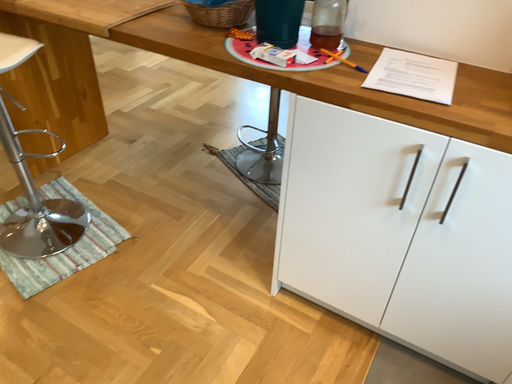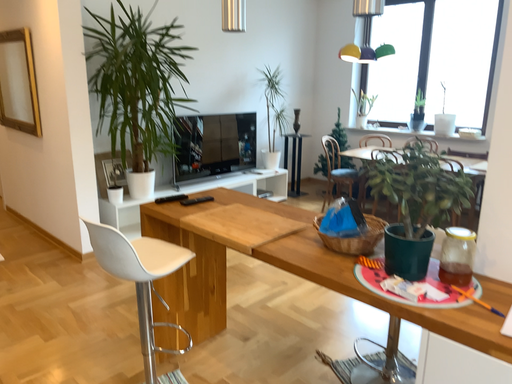
Question: Which way did the camera rotate in the video?

Choices:
 (A) rotated right
 (B) rotated left

Answer: (B)